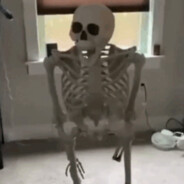
The height and width of the screenshot is (184, 184). I want to click on window sill, so (x=40, y=60).